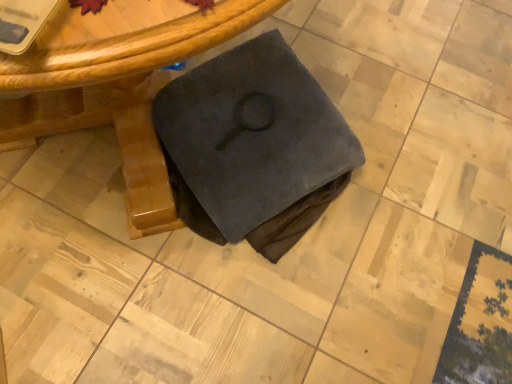
Question: From a real-world perspective, is wooden table at center positioned above or below dark suede book at center?

Choices:
 (A) above
 (B) below

Answer: (A)

Question: Relative to dark suede book at center, is wooden table at center in front or behind?

Choices:
 (A) behind
 (B) front

Answer: (B)

Question: Is point (141, 163) closer or farther from the camera than point (224, 236)?

Choices:
 (A) farther
 (B) closer

Answer: (A)

Question: In the image, is dark suede book at center on the left side or the right side of wooden table at center?

Choices:
 (A) left
 (B) right

Answer: (B)

Question: Do you think dark suede book at center is within wooden table at center, or outside of it?

Choices:
 (A) outside
 (B) inside

Answer: (B)

Question: From the image's perspective, is dark suede book at center above or below wooden table at center?

Choices:
 (A) above
 (B) below

Answer: (B)

Question: Is dark suede book at center bigger or smaller than wooden table at center?

Choices:
 (A) big
 (B) small

Answer: (B)